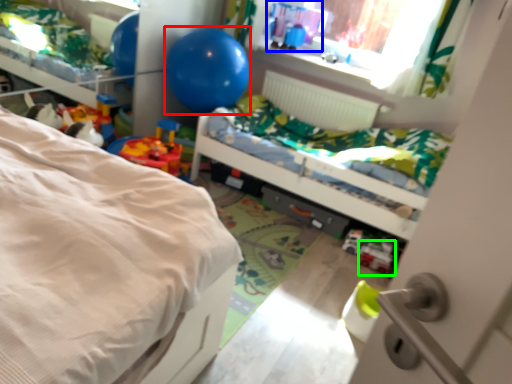
Question: Estimate the real-world distances between objects in this image. Which object is farther from balloon (highlighted by a red box), toy (highlighted by a blue box) or toy (highlighted by a green box)?

Choices:
 (A) toy
 (B) toy

Answer: (B)